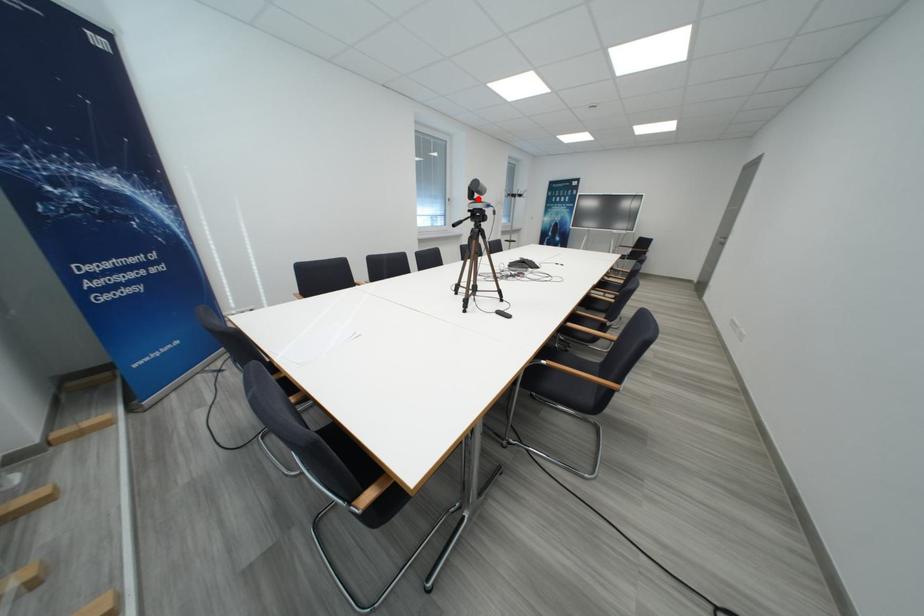
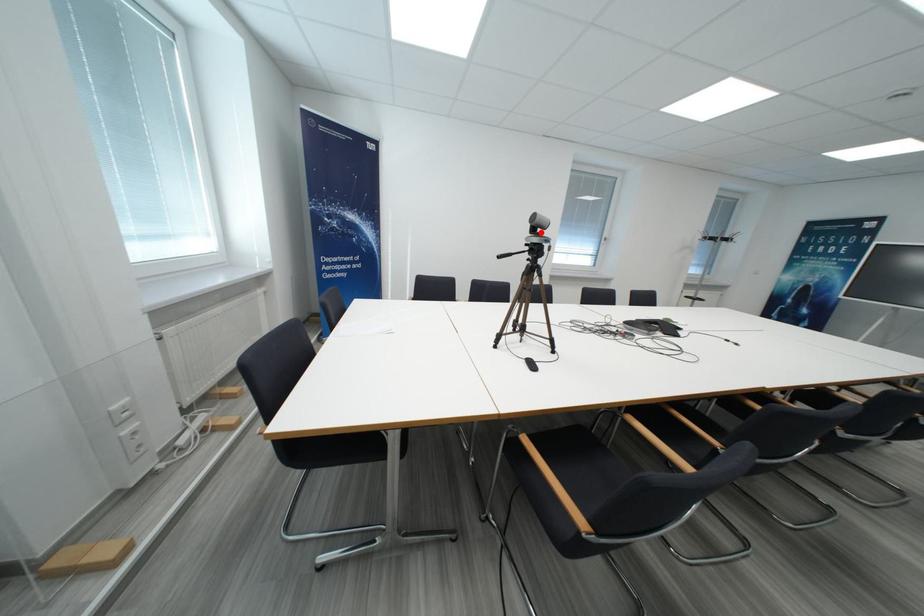
I am providing you with two images of the same scene from different viewpoints. A red point is marked on the first image and another point is marked on the second image. Are the points marked in image1 and image2 representing the same 3D position?

Yes